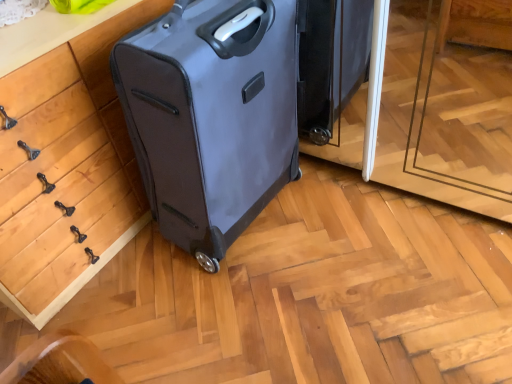
The height and width of the screenshot is (384, 512). In order to click on space that is in front of matte black suitcase at center in this screenshot , I will do `click(249, 306)`.